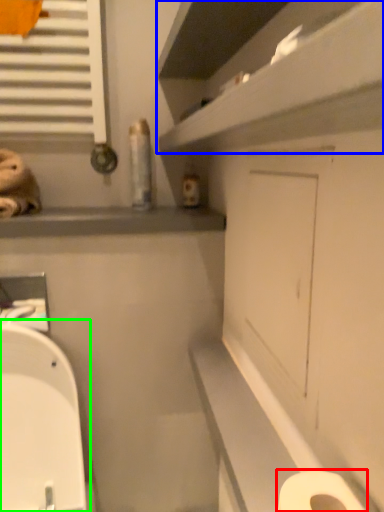
Question: Estimate the real-world distances between objects in this image. Which object is closer to toilet paper (highlighted by a red box), shelf (highlighted by a blue box) or toilet (highlighted by a green box)?

Choices:
 (A) shelf
 (B) toilet

Answer: (A)